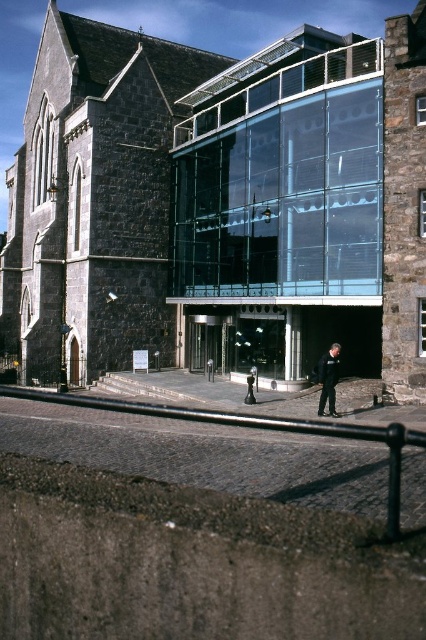
You are an architect visiting the site and need to place a new sculpture between the dark stone church at center and the black leather jacket at lower center. The sculpture requires a space that can accommodate the larger of the two objects. Which object should the sculpture be placed near?

The dark stone church at center is larger than the black leather jacket at lower center, so the sculpture should be placed near the dark stone church at center to ensure there is enough space.

You are standing at the origin point of this coordinate system. Where is the dark stone church at center located in terms of coordinates?

The dark stone church at center is located at coordinates point [219,204].

You are standing in the middle of the street facing the dark stone church at center and the black leather jacket at lower center. Which object is closer to you?

The black leather jacket at lower center is closer to you because the dark stone church at center is further away.